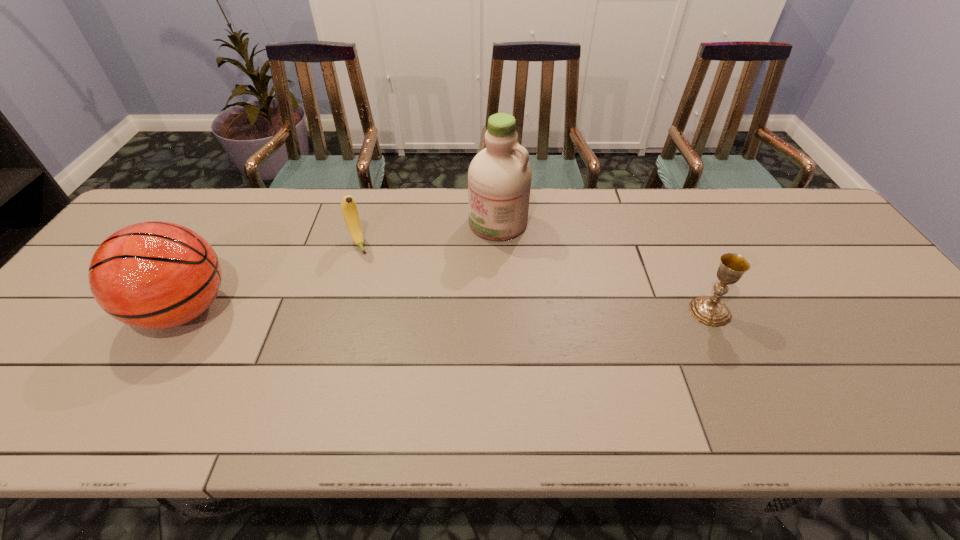
Find the location of a particular element. The width and height of the screenshot is (960, 540). the third shortest object is located at coordinates (154, 275).

Image resolution: width=960 pixels, height=540 pixels. In order to click on the leftmost object in this screenshot , I will do `click(154, 275)`.

The width and height of the screenshot is (960, 540). Identify the location of the rightmost object. (710, 311).

You are a GUI agent. You are given a task and a screenshot of the screen. Output one action in this format:
    pyautogui.click(x=<x>, y=<y>)
    Task: Click on the cleansing agent
    Image resolution: width=960 pixels, height=540 pixels.
    Given the screenshot: What is the action you would take?
    pyautogui.click(x=499, y=177)

Where is `the third object from left to right`? Image resolution: width=960 pixels, height=540 pixels. the third object from left to right is located at coordinates (499, 177).

Find the location of `banana`. banana is located at coordinates (349, 209).

At what (x,y) coordinates should I click in order to perform the action: click on free region located 0.110m on the side with spill of the basketball. Please return your answer as a coordinate pair (x, y). This screenshot has height=540, width=960. Looking at the image, I should click on (91, 310).

This screenshot has width=960, height=540. I want to click on free region located 0.080m on the right of the chalice, so click(x=761, y=312).

Locate an element on the screen. The width and height of the screenshot is (960, 540). vacant region located on the front label of the cleansing agent is located at coordinates (444, 262).

Image resolution: width=960 pixels, height=540 pixels. Find the location of `free space located 0.390m on the front label of the cleansing agent`. free space located 0.390m on the front label of the cleansing agent is located at coordinates (372, 315).